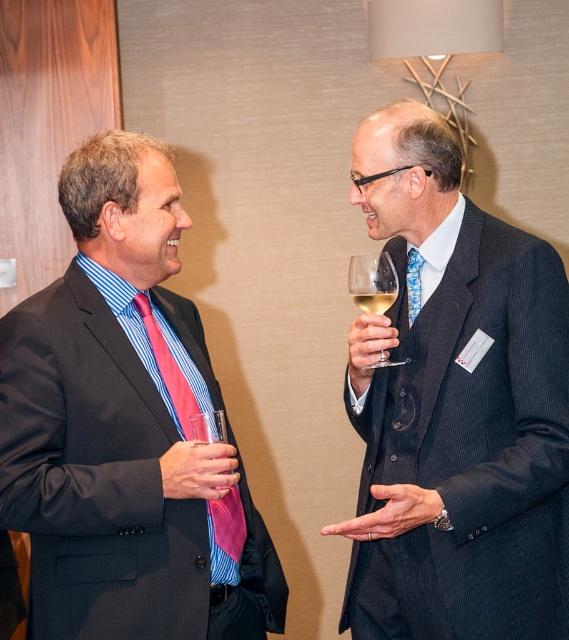
Question: Considering the real-world distances, which object is closest to the pink silk tie at left?

Choices:
 (A) blue printed tie at right
 (B) pink satin tie at left
 (C) dark pinstripe suit at right

Answer: (B)

Question: Is pink silk tie at left to the right of clear glass wine at right from the viewer's perspective?

Choices:
 (A) yes
 (B) no

Answer: (B)

Question: Which point is closer to the camera?

Choices:
 (A) (160, 509)
 (B) (376, 296)

Answer: (A)

Question: Estimate the real-world distances between objects in this image. Which object is closer to the clear glass wine at right?

Choices:
 (A) blue printed tie at right
 (B) clear glass wine glass at upper right
 (C) pink satin tie at left

Answer: (B)

Question: Is clear glass wine glass at upper right above blue printed tie at right?

Choices:
 (A) yes
 (B) no

Answer: (B)

Question: Does pink silk tie at left appear over clear glass wine glass at upper right?

Choices:
 (A) yes
 (B) no

Answer: (B)